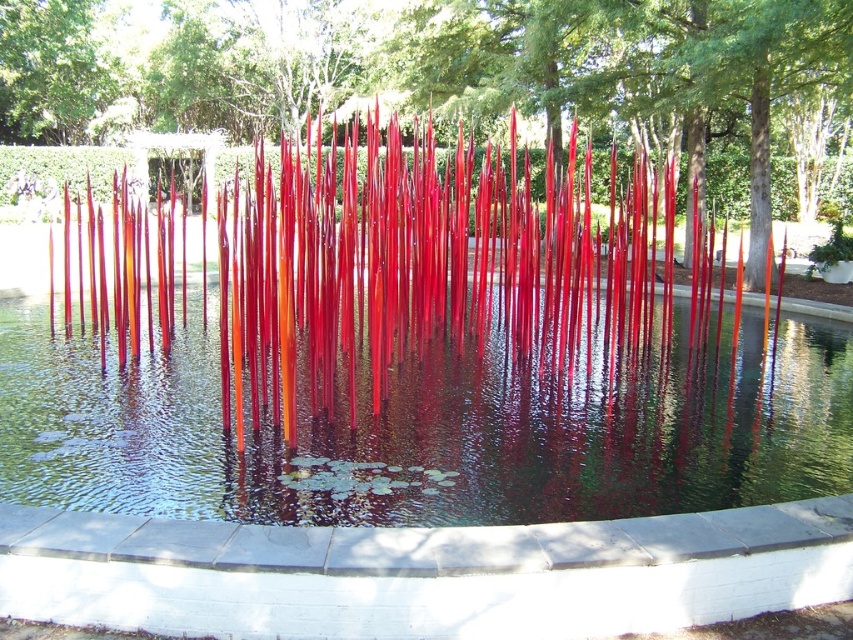
You are standing in the garden and want to take a photo of the glossy glass sculpture at center without the transparent glass water at center appearing in the frame. Based on their positions, which direction should you move to achieve this?

Since the transparent glass water at center is to the right of the glossy glass sculpture at center, you should move to the right side of the sculpture to position yourself where the water is no longer in the frame.

You are a landscape architect designing a pathway around the sculpture. The pathway must be at least 10 meters away from the sculpture to avoid disturbing the reflective pool. Can the transparent glass water at center and glossy glass sculpture at center be placed in such a way that the pathway meets this requirement?

The transparent glass water at center is 11.28 meters from the glossy glass sculpture at center, so yes, the pathway can be placed at least 10 meters away from the sculpture since the distance between them already exceeds the required minimum distance.

You are a visitor standing in the garden and want to take a photo of both the transparent glass water at center and the glossy glass sculpture at center. Which object will appear larger in the photo?

The glossy glass sculpture at center will appear larger in the photo because it is larger in size than the transparent glass water at center.